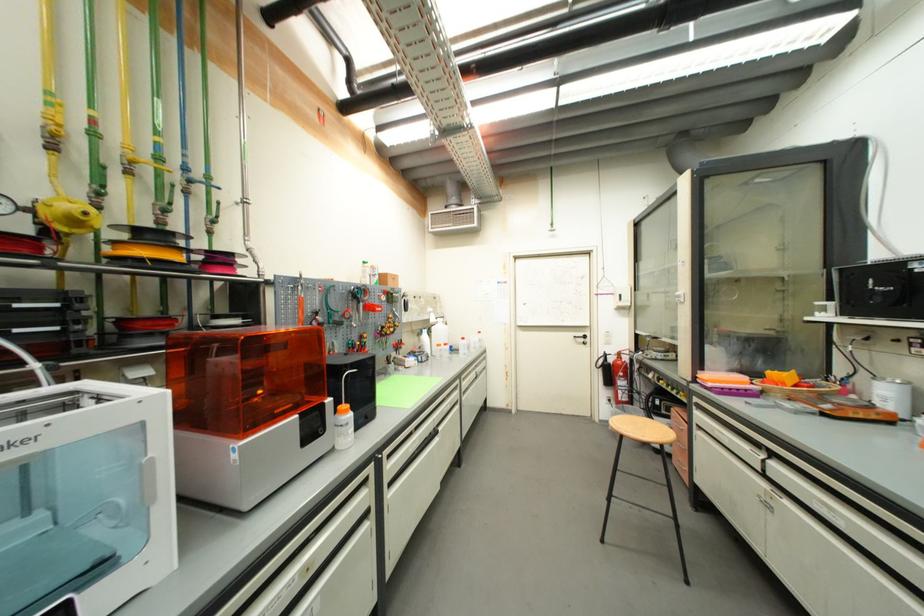
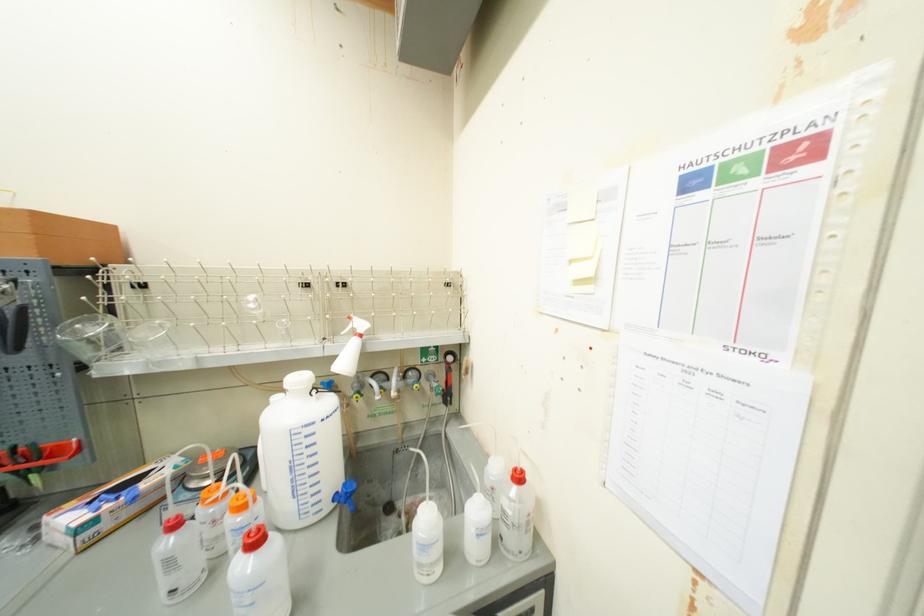
Locate, in the second image, the point that corresponds to point 485,339 in the first image.

(515, 514)